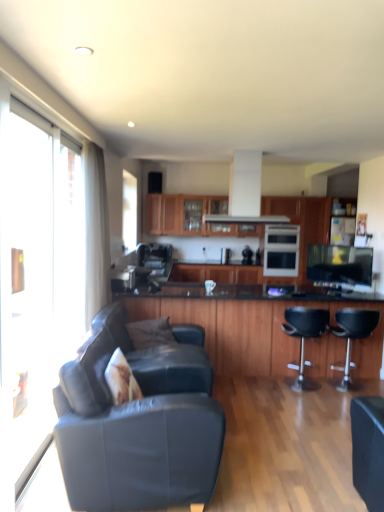
Question: Is white textured pillow at lower left, placed as the first pillow when sorted from front to back, further to the viewer compared to leather couch at lower left?

Choices:
 (A) no
 (B) yes

Answer: (B)

Question: Considering the relative positions of white textured pillow at lower left, placed as the first pillow when sorted from front to back, and leather couch at lower left in the image provided, is white textured pillow at lower left, placed as the first pillow when sorted from front to back, to the right of leather couch at lower left from the viewer's perspective?

Choices:
 (A) no
 (B) yes

Answer: (A)

Question: Can you confirm if white textured pillow at lower left, the 2th pillow when ordered from back to front, is thinner than leather couch at lower left?

Choices:
 (A) no
 (B) yes

Answer: (B)

Question: From a real-world perspective, is white textured pillow at lower left, the 2th pillow when ordered from back to front, positioned over leather couch at lower left based on gravity?

Choices:
 (A) no
 (B) yes

Answer: (B)

Question: Is white textured pillow at lower left, placed as the first pillow when sorted from front to back, wider than leather couch at lower left?

Choices:
 (A) no
 (B) yes

Answer: (A)

Question: From the image's perspective, is wooden cabinet at center, acting as the first cabinetry starting from the back, positioned above or below black leather bar stool at center, positioned as the first chair in right-to-left order?

Choices:
 (A) below
 (B) above

Answer: (B)

Question: In terms of height, does wooden cabinet at center, acting as the first cabinetry starting from the back, look taller or shorter compared to black leather bar stool at center, arranged as the second chair when viewed from the left?

Choices:
 (A) short
 (B) tall

Answer: (A)

Question: Considering the positions of point pyautogui.click(x=182, y=271) and point pyautogui.click(x=332, y=381), is point pyautogui.click(x=182, y=271) closer or farther from the camera than point pyautogui.click(x=332, y=381)?

Choices:
 (A) farther
 (B) closer

Answer: (A)

Question: Which is correct: wooden cabinet at center, which appears as the second cabinetry when viewed from the front, is inside black leather bar stool at center, positioned as the first chair in right-to-left order, or outside of it?

Choices:
 (A) outside
 (B) inside

Answer: (A)

Question: From a real-world perspective, relative to black leather bar stool at center right, placed as the 2th chair when sorted from right to left, is wooden cabinet at center, acting as the first cabinetry starting from the back, vertically above or below?

Choices:
 (A) below
 (B) above

Answer: (B)

Question: Considering the positions of point (228, 278) and point (319, 317), is point (228, 278) closer or farther from the camera than point (319, 317)?

Choices:
 (A) farther
 (B) closer

Answer: (A)

Question: From the image's perspective, is wooden cabinet at center, acting as the first cabinetry starting from the back, above or below black leather bar stool at center right, acting as the first chair starting from the left?

Choices:
 (A) below
 (B) above

Answer: (B)

Question: In terms of size, does wooden cabinet at center, which appears as the second cabinetry when viewed from the front, appear bigger or smaller than black leather bar stool at center right, placed as the 2th chair when sorted from right to left?

Choices:
 (A) small
 (B) big

Answer: (B)

Question: From the image's perspective, is white sheer curtain at left located above or below black leather bar stool at center, positioned as the first chair in right-to-left order?

Choices:
 (A) below
 (B) above

Answer: (B)

Question: Does point (82, 146) appear closer or farther from the camera than point (347, 308)?

Choices:
 (A) farther
 (B) closer

Answer: (B)